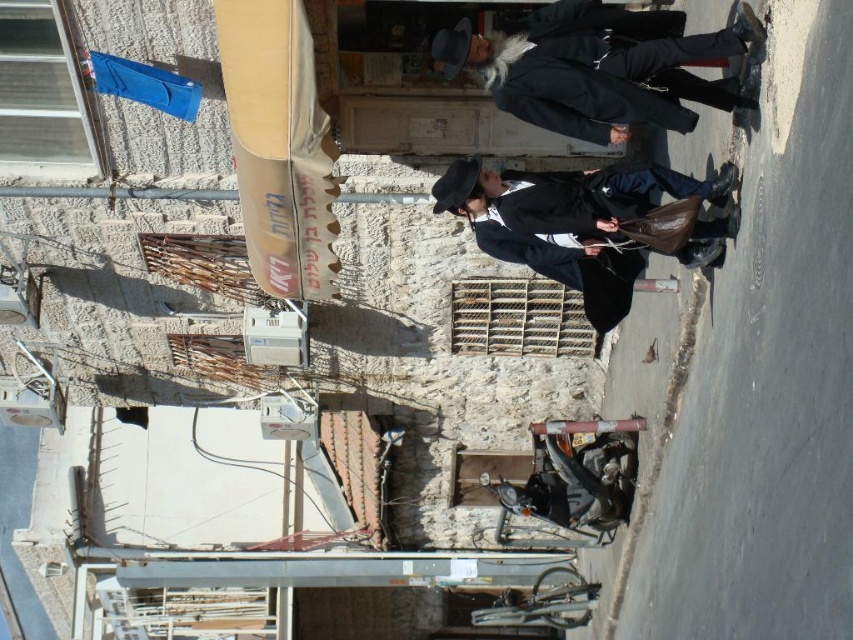
Question: Which object is closer to the camera taking this photo?

Choices:
 (A) dark wool coat at center
 (B) matte black coat at center

Answer: (A)

Question: Does dark wool coat at center have a larger size compared to matte black coat at center?

Choices:
 (A) yes
 (B) no

Answer: (A)

Question: Does dark wool coat at center lie in front of matte black coat at center?

Choices:
 (A) yes
 (B) no

Answer: (A)

Question: Does dark wool coat at center have a larger size compared to matte black coat at center?

Choices:
 (A) yes
 (B) no

Answer: (A)